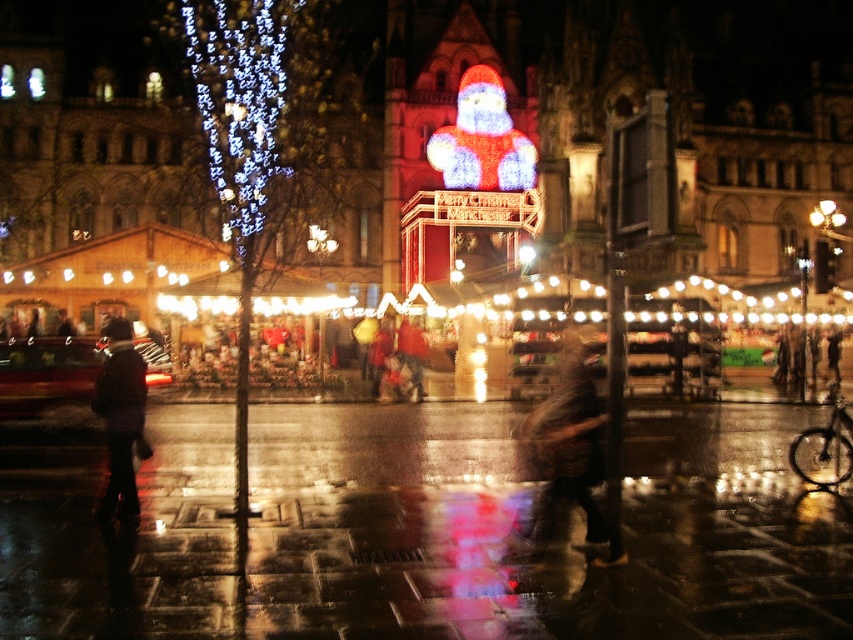
You are standing at the Santa Claus figure and want to take a photo of both the point at coordinates (126,276) and the point at coordinates (502,145). Which point will appear larger in your camera view?

Point at coordinates (126,276) will appear larger in the camera view because it is closer to the camera than point at coordinates (502,145).

You are standing at the entrance of the Christmas market and want to find the white string lights at center. According to the scene description, where should you look in relation to the Santa Claus figure?

The white string lights at center are located at point coordinates relative to the Santa Claus figure, but the exact spatial relationship isn

You are standing in the festive nighttime scene and notice both the white string lights at center and the brown leather jacket at center. Which object is positioned to the left when viewed from your perspective?

The white string lights at center are to the left of the brown leather jacket at center.